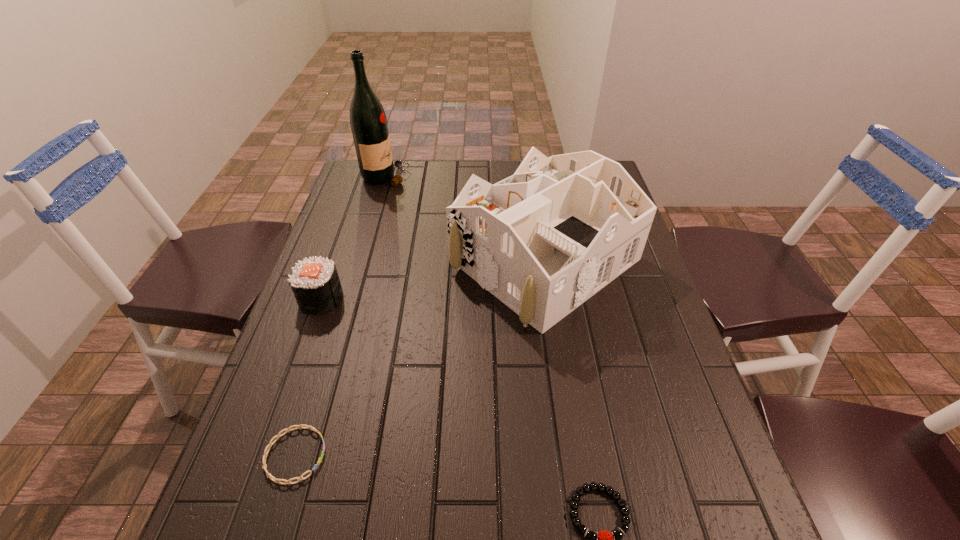
Where is `vacant area that lies between the second tallest object and the sushi`? This screenshot has width=960, height=540. vacant area that lies between the second tallest object and the sushi is located at coordinates 433,279.

Find the location of `vacant point located between the left bracelet and the dollhouse`. vacant point located between the left bracelet and the dollhouse is located at coordinates (420, 357).

Where is `free space between the dollhouse and the left bracelet`? free space between the dollhouse and the left bracelet is located at coordinates (420, 357).

Select which object appears as the fourth closest to the third tallest object. Please provide its 2D coordinates. Your answer should be formatted as a tuple, i.e. [(x, y)], where the tuple contains the x and y coordinates of a point satisfying the conditions above.

[(603, 539)]

Point out which object is positioned as the nearest to the sushi. Please provide its 2D coordinates. Your answer should be formatted as a tuple, i.e. [(x, y)], where the tuple contains the x and y coordinates of a point satisfying the conditions above.

[(543, 241)]

The image size is (960, 540). Find the location of `vacant point that satisfies the following two spatial constraints: 1. on the surface of the second tallest object; 2. on the left side of the tallest object`. vacant point that satisfies the following two spatial constraints: 1. on the surface of the second tallest object; 2. on the left side of the tallest object is located at coordinates (362, 260).

The width and height of the screenshot is (960, 540). I want to click on vacant space that satisfies the following two spatial constraints: 1. on the surface of the dollhouse; 2. on the left side of the tallest object, so click(x=362, y=260).

Find the location of a particular element. This screenshot has width=960, height=540. vacant area in the image that satisfies the following two spatial constraints: 1. on the back side of the second tallest object; 2. on the right side of the sushi is located at coordinates (335, 260).